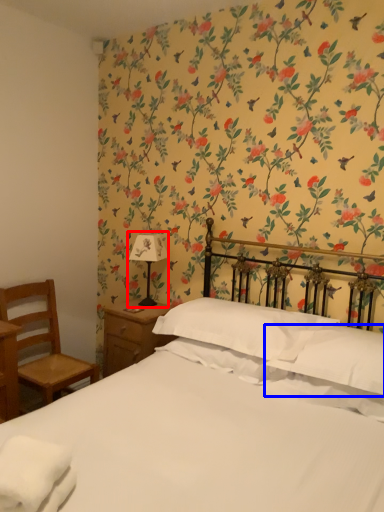
Question: Which object is further to the camera taking this photo, bedside lamp (highlighted by a red box) or pillow (highlighted by a blue box)?

Choices:
 (A) bedside lamp
 (B) pillow

Answer: (A)